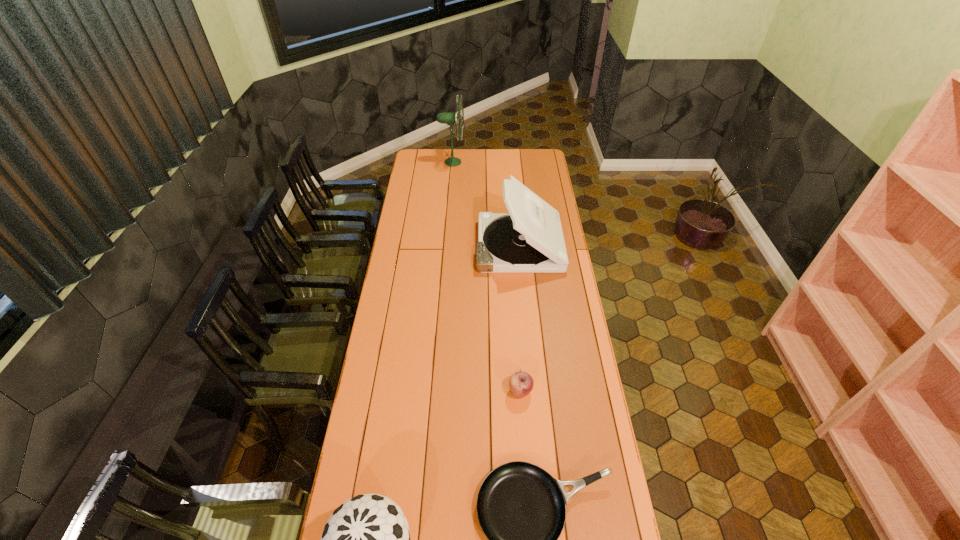
Where is `fan`? This screenshot has height=540, width=960. fan is located at coordinates (447, 118).

The width and height of the screenshot is (960, 540). In order to click on the farthest object in this screenshot , I will do `click(447, 118)`.

Find the location of a particular element. The image size is (960, 540). CD player is located at coordinates (530, 240).

At what (x,y) coordinates should I click in order to perform the action: click on the second farthest object. Please return your answer as a coordinate pair (x, y). The image size is (960, 540). Looking at the image, I should click on (530, 240).

Where is `the fourth tallest object`? the fourth tallest object is located at coordinates (521, 383).

This screenshot has width=960, height=540. Find the location of `the third farthest object`. the third farthest object is located at coordinates (521, 383).

You are a GUI agent. You are given a task and a screenshot of the screen. Output one action in this format:
    pyautogui.click(x=<x>, y=<y>)
    Task: Click on the vacant region located 0.080m on the front-facing side of the fan
    Image resolution: width=960 pixels, height=540 pixels.
    Given the screenshot: What is the action you would take?
    pyautogui.click(x=478, y=162)

The image size is (960, 540). I want to click on free spot located on the control panel of the fourth shortest object, so click(461, 246).

At what (x,y) coordinates should I click in order to perform the action: click on blank space located on the control panel of the fourth shortest object. Please return your answer as a coordinate pair (x, y). Image resolution: width=960 pixels, height=540 pixels. Looking at the image, I should click on coord(429,246).

Where is `vacant space positioned 0.330m on the control panel of the fourth shortest object`? vacant space positioned 0.330m on the control panel of the fourth shortest object is located at coordinates (411, 246).